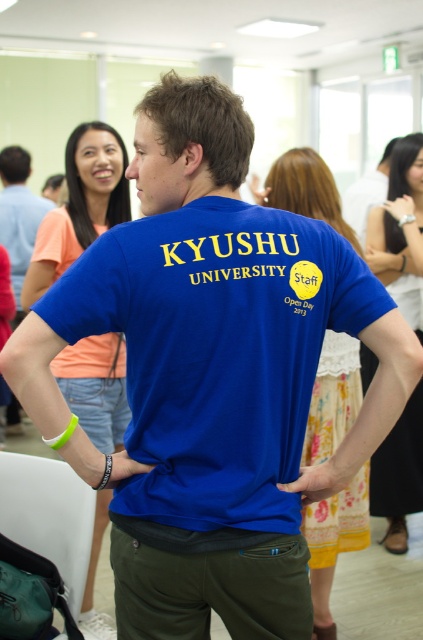
You are standing in the room and want to take a photo of both the point at coordinates point (93, 307) and point (106, 620). Which point should you focus on first to ensure both are in focus?

You should focus on point (93, 307) first because it is closer to the camera than point (106, 620), ensuring both will be in focus when using the camera.